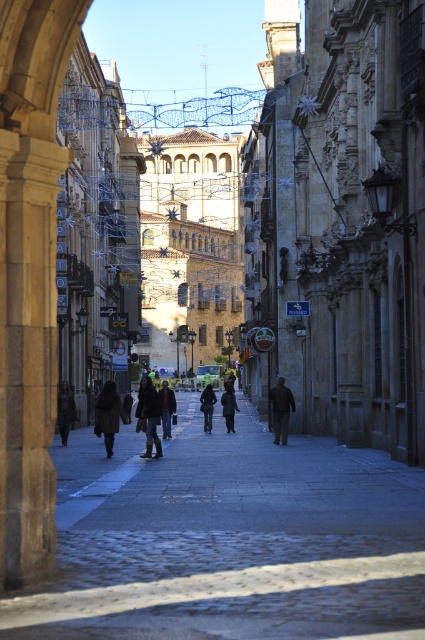
You are standing on the sidewalk in the European city street scene. You see a dark brown coat at center. Where exactly is the dark brown coat located in terms of coordinates?

The dark brown coat at center is located at coordinates point (280, 408).

You are standing at the entrance of the street and want to find the dark blue jacket at center. Based on the coordinates provided, in which direction should you look to locate it?

The dark blue jacket at center is located at coordinates point (167, 406), so you should look towards the center of the image to find it.

You are standing at the point marked by the coordinates (167, 406) in the image. What is the color of the jacket worn by the person standing at this location?

The dark blue jacket at center is located at the coordinates (167, 406), so the jacket is dark blue.